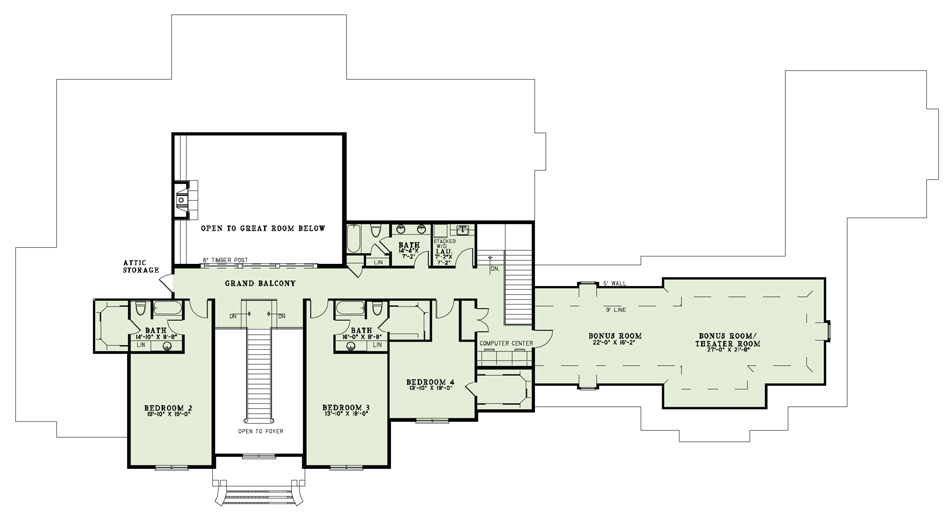
Image resolution: width=950 pixels, height=517 pixels. What are the coordinates of `stairs` in the screenshot? It's located at (519, 277), (256, 376).